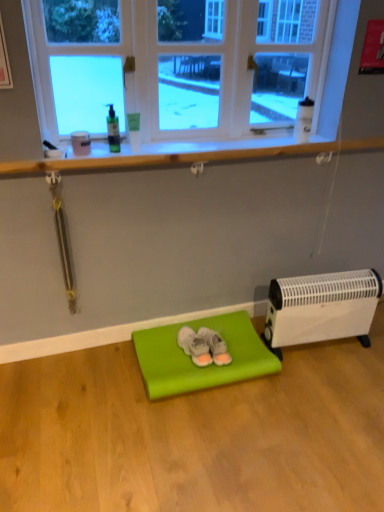
Find the location of a particular element. This screenshot has width=384, height=512. free point in front of matte green yoga mat at center is located at coordinates (213, 444).